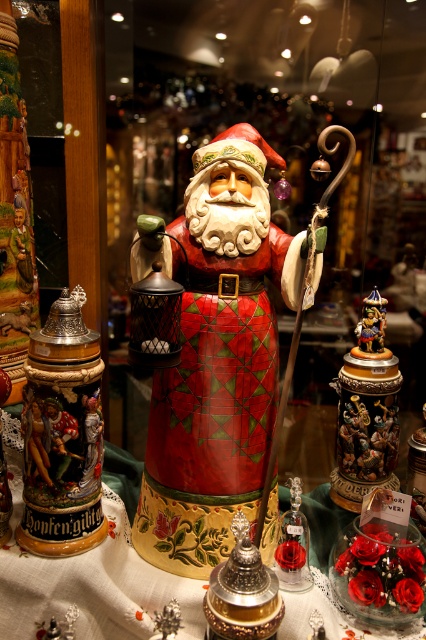
You are a customer standing in front of the shop window display. You see the shiny silver ornament at center. Can you reach it without moving closer than 30 inches from where you are currently standing?

The shiny silver ornament at center is 31.48 inches away from the viewer. Since the distance is more than 30 inches, you cannot reach it without moving closer.

You are a photographer setting up a shot of the festive display. You need to focus on one of the two points in the scene, point 1 at coordinates point (186,193) and point 2 at coordinates point (301,531). Which point should you focus on to ensure it appears sharper in the final image?

Point (186,193) is closer to the camera than point (301,531), so focusing on point (186,193) will result in a sharper image.

You are setting up a holiday display and have a space that can only accommodate items up to the width of the shiny silver ornament at center. You want to place the gold metallic carousel at right in this space. Based on the scene description, will it fit?

The gold metallic carousel at right is wider than the shiny silver ornament at center, so it will not fit in the space allocated for items up to the ornament size.